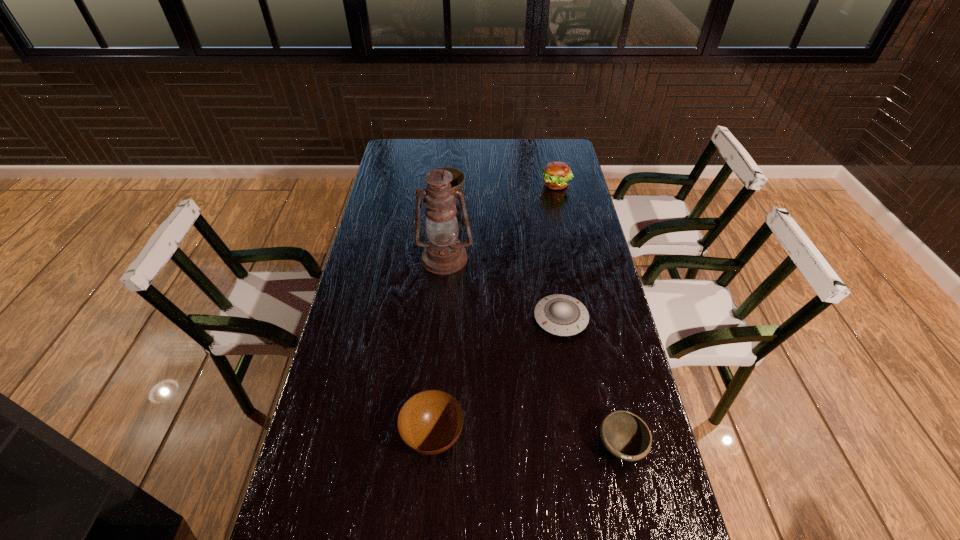
Identify the location of vacant space at the right edge of the desktop. (598, 397).

Identify the location of free space between the third farthest object and the shortest object. (503, 288).

At what (x,y) coordinates should I click in order to perform the action: click on free spot between the second tallest bowl and the farthest bowl. Please return your answer as a coordinate pair (x, y). Image resolution: width=960 pixels, height=540 pixels. Looking at the image, I should click on click(440, 317).

The image size is (960, 540). Find the location of `vacant space in between the second tallest bowl and the hamburger`. vacant space in between the second tallest bowl and the hamburger is located at coordinates (494, 310).

Locate an element on the screen. free space between the second shortest bowl and the shortest bowl is located at coordinates (527, 441).

Find the location of a particular element. The image size is (960, 540). vacant space that is in between the third nearest object and the farthest bowl is located at coordinates (504, 259).

Image resolution: width=960 pixels, height=540 pixels. Identify the location of free space between the second shortest bowl and the shortest object. (497, 377).

Select which object is the third closest to the fifth tallest object. Please provide its 2D coordinates. Your answer should be formatted as a tuple, i.e. [(x, y)], where the tuple contains the x and y coordinates of a point satisfying the conditions above.

[(443, 254)]

This screenshot has height=540, width=960. What are the coordinates of `object that ranks as the fourth closest to the fifth tallest object` in the screenshot? It's located at (457, 182).

Identify the location of bowl that is the closest to the fifth tallest object. Image resolution: width=960 pixels, height=540 pixels. (430, 422).